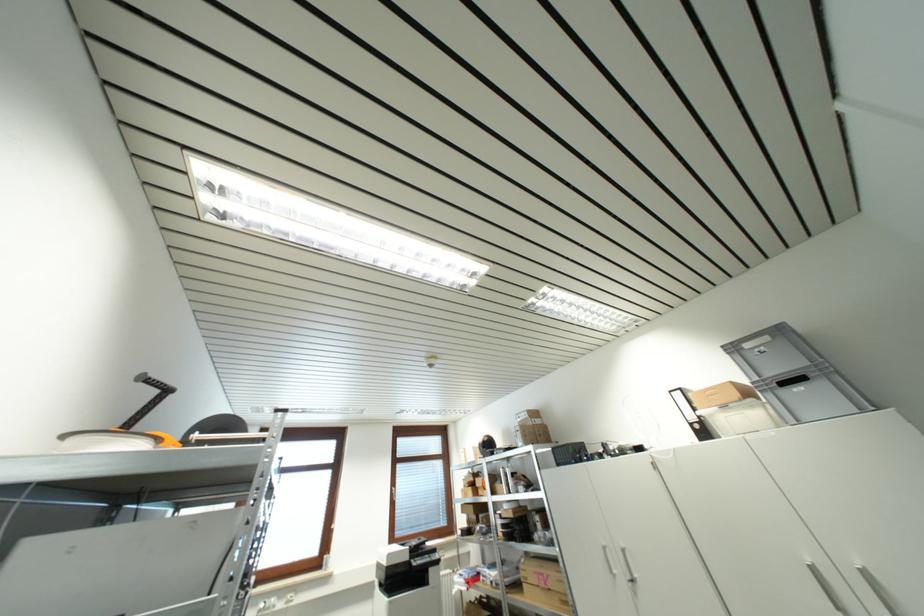
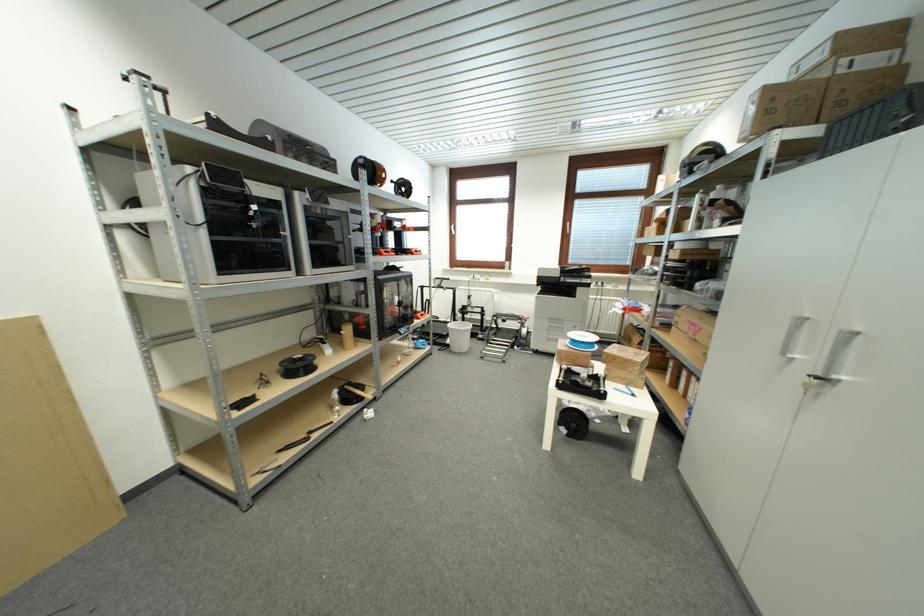
The point at (546, 586) is marked in the first image. Where is the corresponding point in the second image?

(696, 334)